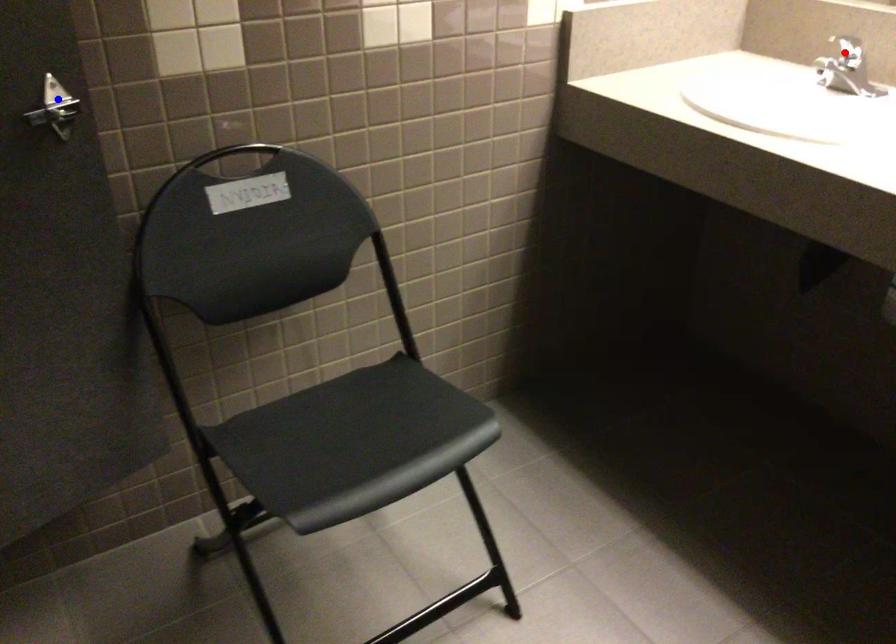
Question: In the image, two points are highlighted. Which point is nearer to the camera? Reply with the corresponding letter.

Choices:
 (A) blue point
 (B) red point

Answer: (A)